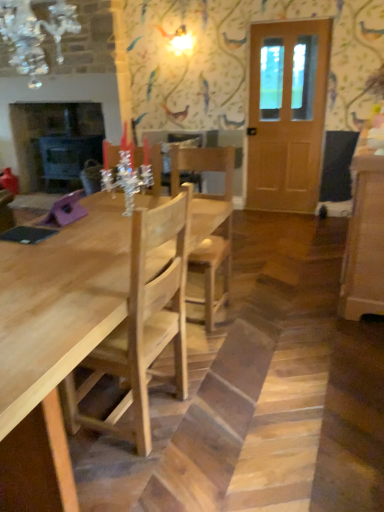
Question: Does point (276, 145) appear closer or farther from the camera than point (198, 303)?

Choices:
 (A) farther
 (B) closer

Answer: (A)

Question: Based on their positions, is wooden door at right located to the left or right of natural wood chair at center?

Choices:
 (A) right
 (B) left

Answer: (A)

Question: Which object is the farthest from the matte black fireplace at left?

Choices:
 (A) light brown wood cabinet at right
 (B) wooden door at right
 (C) natural wood chair at center
 (D) light wood table at center
 (E) crystal glass chandelier at upper left

Answer: (A)

Question: Estimate the real-world distances between objects in this image. Which object is farther from the light brown wood cabinet at right?

Choices:
 (A) wooden door at right
 (B) light wood table at center
 (C) matte black fireplace at left
 (D) natural wood chair at center
 (E) crystal glass chandelier at upper left

Answer: (C)